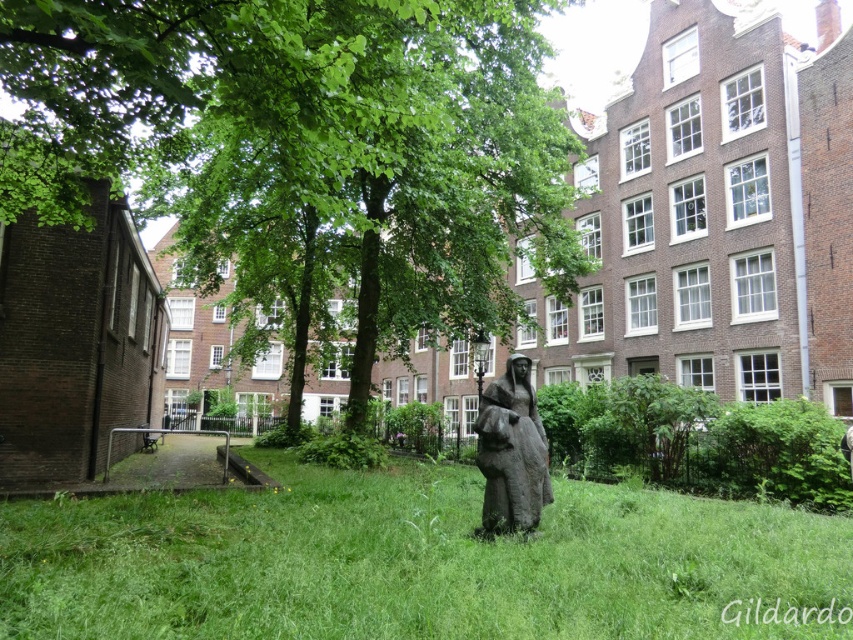
Question: Estimate the real-world distances between objects in this image. Which object is farther from the green leafy tree at center?

Choices:
 (A) bronze statue at center
 (B) green grassy at center

Answer: (A)

Question: Can you confirm if green grassy at center is positioned below bronze statue at center?

Choices:
 (A) no
 (B) yes

Answer: (B)

Question: Can you confirm if green leafy tree at center is bigger than green grassy at center?

Choices:
 (A) yes
 (B) no

Answer: (A)

Question: Which is farther from the bronze statue at center?

Choices:
 (A) green leafy tree at center
 (B) green grassy at center

Answer: (A)

Question: Is green leafy tree at center to the left of bronze statue at center from the viewer's perspective?

Choices:
 (A) no
 (B) yes

Answer: (B)

Question: Which of the following is the farthest from the observer?

Choices:
 (A) green leafy tree at center
 (B) bronze statue at center

Answer: (B)